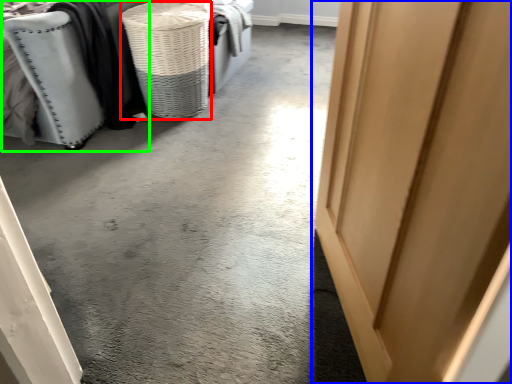
Question: Based on their relative distances, which object is farther from basket (highlighted by a red box)? Choose from door (highlighted by a blue box) and furniture (highlighted by a green box).

Choices:
 (A) door
 (B) furniture

Answer: (A)